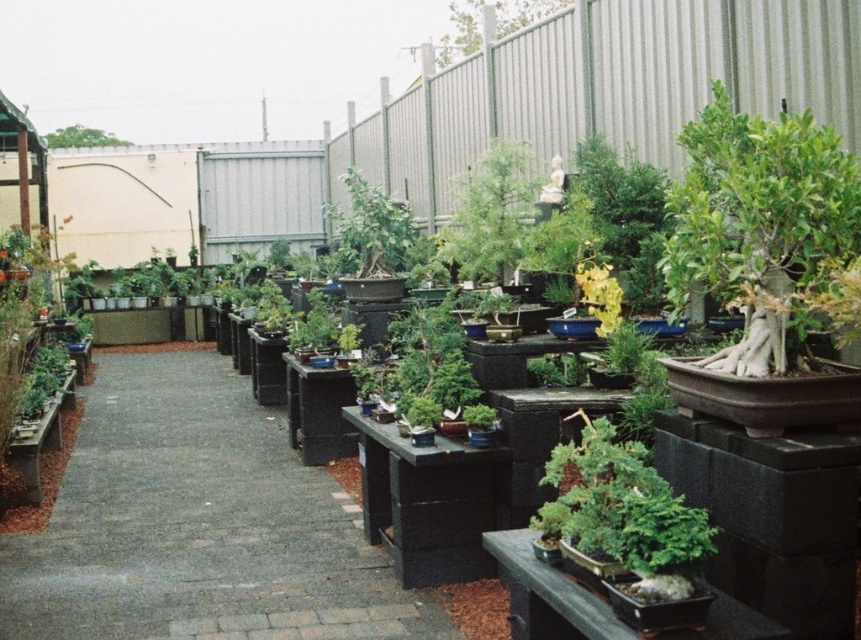
Between point (139, 404) and point (67, 140), which one is positioned behind?

Positioned behind is point (67, 140).

Based on the photo, does gray concrete path at center have a greater width compared to green leafy tree at upper left?

Yes, gray concrete path at center is wider than green leafy tree at upper left.

Is point (286, 529) in front of point (84, 132)?

That is True.

Image resolution: width=861 pixels, height=640 pixels. Find the location of `gray concrete path at center`. gray concrete path at center is located at coordinates (197, 524).

Who is higher up, green matte bonsai at right or green matte tree at upper center?

green matte tree at upper center is above.

Between point (723, 108) and point (554, 8), which one is positioned behind?

The point (554, 8) is behind.

This screenshot has height=640, width=861. I want to click on green matte bonsai at right, so click(759, 218).

Is gray concrete path at center closer to the viewer compared to green matte bonsai at right?

No, gray concrete path at center is further to the viewer.

Does point (203, 460) come behind point (771, 342)?

Yes, point (203, 460) is behind point (771, 342).

At what (x,y) coordinates should I click in order to perform the action: click on gray concrete path at center. Please return your answer as a coordinate pair (x, y). Looking at the image, I should click on (197, 524).